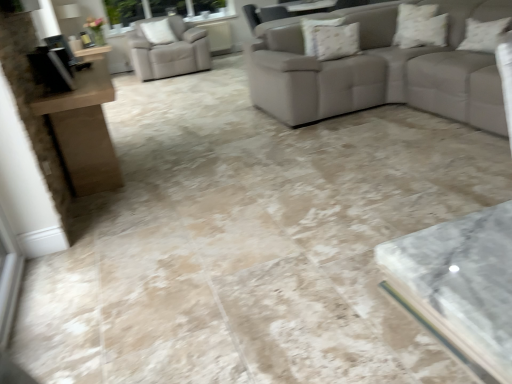
Find the location of a particular element. The height and width of the screenshot is (384, 512). beige leather armchair at upper left is located at coordinates (168, 50).

Is beige leather armchair at upper left closer to the viewer compared to white textured pillow at upper right, marked as the 3th pillow in a back-to-front arrangement?

That is False.

Considering the points (139, 64) and (418, 14), which point is behind, point (139, 64) or point (418, 14)?

The point (139, 64) is more distant.

From the picture: Can you see beige leather armchair at upper left touching white textured pillow at upper right, arranged as the second pillow when viewed from the top?

No, beige leather armchair at upper left is not touching white textured pillow at upper right, arranged as the second pillow when viewed from the top.

At what (x,y) coordinates should I click in order to perform the action: click on chair on the left of white textured pillow at upper right, the fourth pillow positioned from the left. Please return your answer as a coordinate pair (x, y). This screenshot has height=384, width=512. Looking at the image, I should click on (168, 50).

Is beige leather armchair at upper left far from white textured pillow at upper right, the fourth pillow positioned from the top?

That's right, there is a large distance between beige leather armchair at upper left and white textured pillow at upper right, the fourth pillow positioned from the top.

Is white textured pillow at upper right, which appears as the 1th pillow when viewed from the right, at the back of beige leather armchair at upper left?

That's not correct — beige leather armchair at upper left is not looking away from white textured pillow at upper right, which appears as the 1th pillow when viewed from the right.

Is beige leather armchair at upper left inside or outside of white textured pillow at upper right, the fourth pillow positioned from the top?

The correct answer is: outside.

From a real-world perspective, does white textured pillow at upper right, which is the 3th pillow from bottom to top, sit lower than white textured pillow at upper left, arranged as the fourth pillow when viewed from the front?

Indeed, from a real-world perspective, white textured pillow at upper right, which is the 3th pillow from bottom to top, is positioned beneath white textured pillow at upper left, arranged as the fourth pillow when viewed from the front.

Does white textured pillow at upper right, the 2th pillow viewed from the right, come in front of white textured pillow at upper left, the fourth pillow positioned from the right?

Yes.

Considering the positions of objects white textured pillow at upper right, the 2th pillow viewed from the right, and white textured pillow at upper left, the first pillow in the back-to-front sequence, in the image provided, who is more to the right, white textured pillow at upper right, the 2th pillow viewed from the right, or white textured pillow at upper left, the first pillow in the back-to-front sequence,?

white textured pillow at upper right, the 2th pillow viewed from the right.

Is white textured pillow at upper right, the 2th pillow viewed from the right, far away from white textured pillow at upper left, arranged as the fourth pillow when viewed from the front?

white textured pillow at upper right, the 2th pillow viewed from the right, is positioned a significant distance from white textured pillow at upper left, arranged as the fourth pillow when viewed from the front.

Is point (460, 44) behind point (358, 28)?

No.

Is white textured pillow at upper right, the fourth pillow positioned from the top, far from floral fabric pillow at upper center, the third pillow positioned from the front?

Yes.

Looking at this image, is white textured pillow at upper right, the fourth pillow positioned from the top, smaller than floral fabric pillow at upper center, the third pillow positioned from the front?

No, white textured pillow at upper right, the fourth pillow positioned from the top, is not smaller than floral fabric pillow at upper center, the third pillow positioned from the front.

Based on the photo, considering the sizes of objects white textured pillow at upper right, positioned as the first pillow in front-to-back order, and floral fabric pillow at upper center, which is the 2th pillow in left-to-right order, in the image provided, who is taller, white textured pillow at upper right, positioned as the first pillow in front-to-back order, or floral fabric pillow at upper center, which is the 2th pillow in left-to-right order,?

With more height is white textured pillow at upper right, positioned as the first pillow in front-to-back order.

Is point (172, 33) positioned in front of point (342, 48)?

No, (172, 33) is further to viewer.

From the image's perspective, relative to floral fabric pillow at upper center, which is the 2th pillow in left-to-right order, is white textured pillow at upper left, the fourth pillow positioned from the right, above or below?

white textured pillow at upper left, the fourth pillow positioned from the right, is above floral fabric pillow at upper center, which is the 2th pillow in left-to-right order.

Looking at this image, is white textured pillow at upper left, the fourth pillow positioned from the right, facing towards floral fabric pillow at upper center, which is the second pillow from bottom to top?

Yes, white textured pillow at upper left, the fourth pillow positioned from the right, is facing floral fabric pillow at upper center, which is the second pillow from bottom to top.

Which of these two, white textured pillow at upper left, arranged as the fourth pillow when viewed from the front, or floral fabric pillow at upper center, the third pillow positioned from the front, is wider?

With larger width is white textured pillow at upper left, arranged as the fourth pillow when viewed from the front.

Which is nearer, [310,39] or [147,37]?

Point [310,39] is positioned closer to the camera compared to point [147,37].

From the image's perspective, is floral fabric pillow at upper center, arranged as the second pillow when viewed from the back, over white textured pillow at upper left, the first pillow in the back-to-front sequence?

No.

Considering the sizes of objects floral fabric pillow at upper center, which is the 2th pillow in left-to-right order, and white textured pillow at upper left, the first pillow in the back-to-front sequence, in the image provided, who is smaller, floral fabric pillow at upper center, which is the 2th pillow in left-to-right order, or white textured pillow at upper left, the first pillow in the back-to-front sequence,?

floral fabric pillow at upper center, which is the 2th pillow in left-to-right order.

Is floral fabric pillow at upper center, the third pillow positioned from the front, thinner than white textured pillow at upper left, the first pillow in the back-to-front sequence?

Yes, floral fabric pillow at upper center, the third pillow positioned from the front, is thinner than white textured pillow at upper left, the first pillow in the back-to-front sequence.

From a real-world perspective, is floral fabric pillow at upper center, which is the second pillow from bottom to top, under white textured pillow at upper right, acting as the first pillow starting from the bottom?

Actually, floral fabric pillow at upper center, which is the second pillow from bottom to top, is physically above white textured pillow at upper right, acting as the first pillow starting from the bottom, in the real world.

Considering the points (321, 56) and (468, 40), which point is in front, point (321, 56) or point (468, 40)?

The point (321, 56) is closer to the camera.

Is floral fabric pillow at upper center, which is the 2th pillow in left-to-right order, behind white textured pillow at upper right, the fourth pillow positioned from the top?

Yes, floral fabric pillow at upper center, which is the 2th pillow in left-to-right order, is further from the viewer.

From the image's perspective, which is above, floral fabric pillow at upper center, the 3th pillow positioned from the top, or white textured pillow at upper right, which appears as the 1th pillow when viewed from the right?

floral fabric pillow at upper center, the 3th pillow positioned from the top, appears higher in the image.

I want to click on chair above the white textured pillow at upper right, arranged as the second pillow when viewed from the top (from the image's perspective), so click(x=168, y=50).

Locate an element on the screen. This screenshot has width=512, height=384. the 1st pillow located above the beige leather armchair at upper left (from a real-world perspective) is located at coordinates (483, 34).

When comparing their distances from white textured pillow at upper right, the 4th pillow positioned from the back, does beige leather armchair at upper left or white textured pillow at upper right, arranged as the second pillow when viewed from the top, seem further?

beige leather armchair at upper left lies further to white textured pillow at upper right, the 4th pillow positioned from the back, than the other object.

Considering their positions, is floral fabric pillow at upper center, the 3th pillow positioned from the top, positioned further to white textured pillow at upper right, arranged as the second pillow when viewed from the top, than beige leather armchair at upper left?

beige leather armchair at upper left lies further to white textured pillow at upper right, arranged as the second pillow when viewed from the top, than the other object.

When comparing their distances from white textured pillow at upper left, the fourth pillow positioned from the right, does beige leather armchair at upper left or white textured pillow at upper right, which is counted as the 3th pillow, starting from the left, seem closer?

beige leather armchair at upper left.

Which object lies further to the anchor point white textured pillow at upper right, the fourth pillow positioned from the left, beige leather armchair at upper left or floral fabric pillow at upper center, which ranks as the third pillow in right-to-left order?

Based on the image, beige leather armchair at upper left appears to be further to white textured pillow at upper right, the fourth pillow positioned from the left.

Looking at this image, estimate the real-world distances between objects in this image. Which object is further from floral fabric pillow at upper center, which ranks as the third pillow in right-to-left order, white textured pillow at upper left, placed as the fourth pillow when sorted from bottom to top, or white textured pillow at upper right, positioned as the first pillow in front-to-back order?

Based on the image, white textured pillow at upper left, placed as the fourth pillow when sorted from bottom to top, appears to be further to floral fabric pillow at upper center, which ranks as the third pillow in right-to-left order.

Based on their spatial positions, is white textured pillow at upper right, the 4th pillow positioned from the back, or beige leather armchair at upper left closer to white textured pillow at upper right, which is the 3th pillow from bottom to top?

Based on the image, white textured pillow at upper right, the 4th pillow positioned from the back, appears to be nearer to white textured pillow at upper right, which is the 3th pillow from bottom to top.

Estimate the real-world distances between objects in this image. Which object is further from beige leather armchair at upper left, white textured pillow at upper left, positioned as the 1th pillow in left-to-right order, or white textured pillow at upper right, marked as the 3th pillow in a back-to-front arrangement?

white textured pillow at upper right, marked as the 3th pillow in a back-to-front arrangement.

From the image, which object appears to be farther from white textured pillow at upper right, which appears as the 1th pillow when viewed from the right, white textured pillow at upper left, which is the first pillow from top to bottom, or white textured pillow at upper right, which is counted as the 3th pillow, starting from the left?

The object further to white textured pillow at upper right, which appears as the 1th pillow when viewed from the right, is white textured pillow at upper left, which is the first pillow from top to bottom.

You are a GUI agent. You are given a task and a screenshot of the screen. Output one action in this format:
    pyautogui.click(x=<x>, y=<y>)
    Task: Click on the pillow located between floral fabric pillow at upper center, the 3th pillow positioned from the top, and white textured pillow at upper right, acting as the first pillow starting from the bottom, in the left-right direction
    
    Given the screenshot: What is the action you would take?
    pyautogui.click(x=420, y=26)

Find the location of `pillow between floral fabric pillow at upper center, which is the second pillow from bottom to top, and beige leather armchair at upper left from front to back`. pillow between floral fabric pillow at upper center, which is the second pillow from bottom to top, and beige leather armchair at upper left from front to back is located at coordinates (158, 32).

Where is `pillow located between white textured pillow at upper left, placed as the fourth pillow when sorted from bottom to top, and white textured pillow at upper right, which is the 3th pillow from bottom to top, in the left-right direction`? The width and height of the screenshot is (512, 384). pillow located between white textured pillow at upper left, placed as the fourth pillow when sorted from bottom to top, and white textured pillow at upper right, which is the 3th pillow from bottom to top, in the left-right direction is located at coordinates (334, 41).